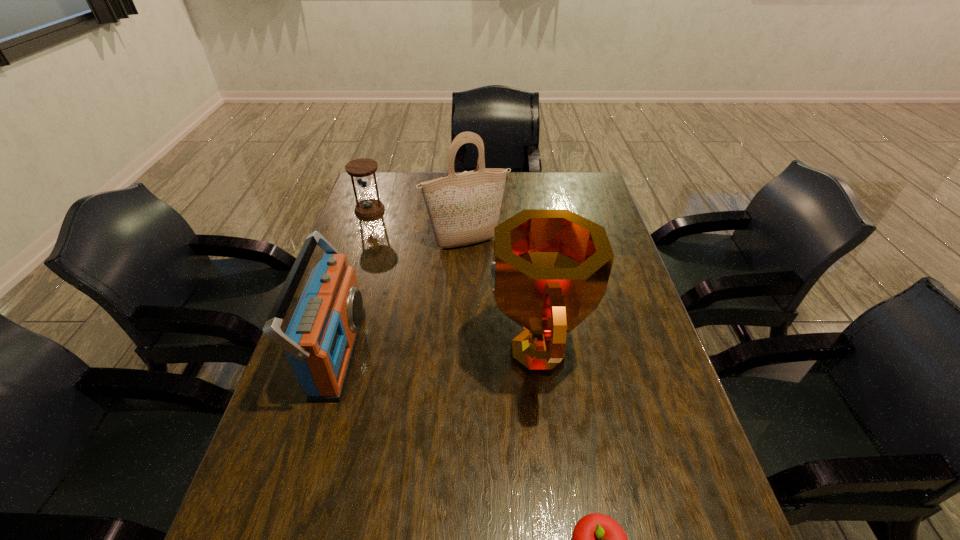
Find the location of a particular element. unoccupied position between the radio receiver and the award is located at coordinates (437, 352).

Locate an element on the screen. vacant point located between the radio receiver and the fourth nearest object is located at coordinates (401, 298).

This screenshot has width=960, height=540. What are the coordinates of `vacant region between the shopping bag and the farthest object` in the screenshot? It's located at (418, 227).

At what (x,y) coordinates should I click in order to perform the action: click on the fourth closest object to the third shortest object. Please return your answer as a coordinate pair (x, y). The image size is (960, 540). Looking at the image, I should click on (597, 539).

Where is `the closest object to the third shortest object`? the closest object to the third shortest object is located at coordinates (464, 208).

Locate an element on the screen. free location that satisfies the following two spatial constraints: 1. on the front side of the shopping bag; 2. on the front-facing side of the third tallest object is located at coordinates (462, 352).